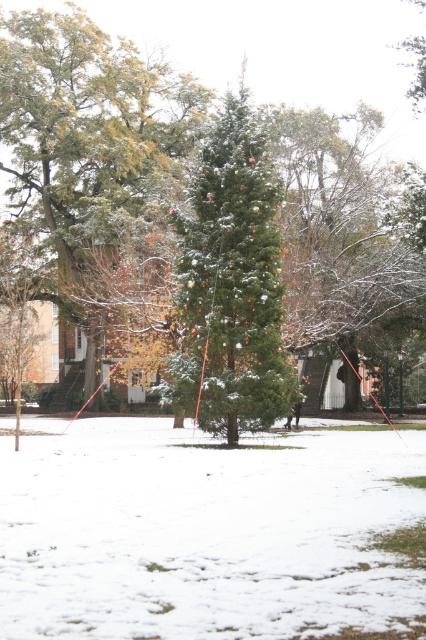
Between point (244, 465) and point (201, 426), which one is positioned in front?

Positioned in front is point (244, 465).

Is point (210, 490) positioned behind point (224, 396)?

No, it is in front of (224, 396).

Locate an element on the screen. The height and width of the screenshot is (640, 426). white fluffy snow at center is located at coordinates (203, 532).

Does white fluffy snow at center have a lesser height compared to green matte evergreen tree at center?

Indeed, white fluffy snow at center has a lesser height compared to green matte evergreen tree at center.

Between point (106, 476) and point (39, 26), which one is positioned behind?

The point (39, 26) is behind.

Where is `white fluffy snow at center`? Image resolution: width=426 pixels, height=640 pixels. white fluffy snow at center is located at coordinates (203, 532).

Is green matte evergreen tree at center above green matte tree at center?

Yes, green matte evergreen tree at center is above green matte tree at center.

Can you confirm if green matte evergreen tree at center is smaller than green matte tree at center?

Actually, green matte evergreen tree at center might be larger than green matte tree at center.

What are the coordinates of `green matte evergreen tree at center` in the screenshot? It's located at (86, 136).

Find the location of a particular element. The image size is (426, 640). green matte evergreen tree at center is located at coordinates pos(86,136).